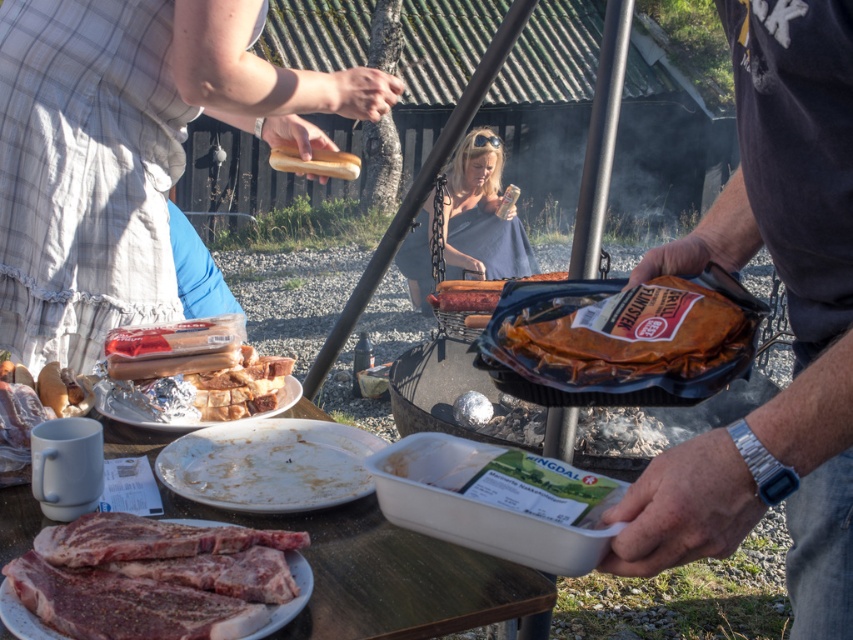
You are a guest at the barbecue and want to place a napkin on the table. The napkin is as tall as the white matte plate at center. Can you place it on top of the dark gray fabric shirt at center without it hanging off?

The dark gray fabric shirt at center is taller than the white matte plate at center. Since the napkin is as tall as the plate, it would be shorter than the shirt. Therefore, placing the napkin on the shirt would cause it to hang off the bottom, as it isn

Consider the image. You are standing at the edge of the barbecue area and need to reach both the gray matte dress at center and the silver foil plate at center. Which one is farther from your current position?

The gray matte dress at center is 4.66 meters away from the silver foil plate at center. Since you are at the edge of the barbecue area, it depends on your exact position. However, without additional information, we can only state the distance between them, not their individual distances from you.

Where is the dark gray fabric shirt at center located in the image?

The dark gray fabric shirt at center is located at the point with coordinates 0.500 on the x axis and 0.926 on the y axis.